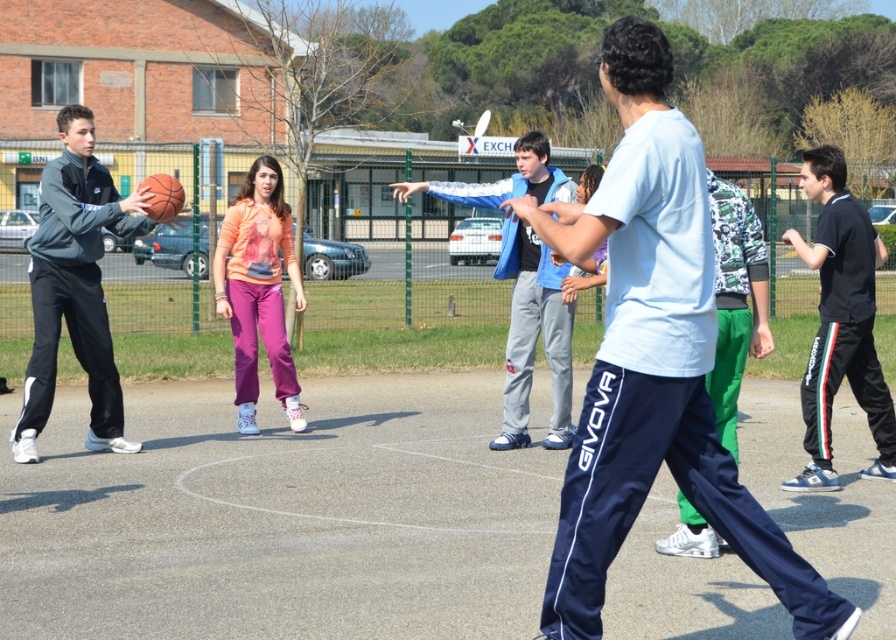
You are a photographer standing behind the boy in the light blue tshirt and navy blue track pants with GIVOVA. You want to take a photo of the dark gray track pants at left and the rubber textured basketball at center. Which object will appear larger in your photo?

The dark gray track pants at left will appear larger in the photo because it is closer to the photographer than the rubber textured basketball at center.

You are a photographer trying to capture a wide shot of the basketball game. You need to ensure that both the dark gray track pants at left and the rubber textured basketball at center are clearly visible in your frame. Given that your camera has a fixed focus range, which object should you prioritize focusing on to ensure clarity, considering their sizes?

The dark gray track pants at left is larger than the rubber textured basketball at center, so focusing on the dark gray track pants at left would ensure clarity since larger objects generally require less precise focus to appear sharp in a photograph.